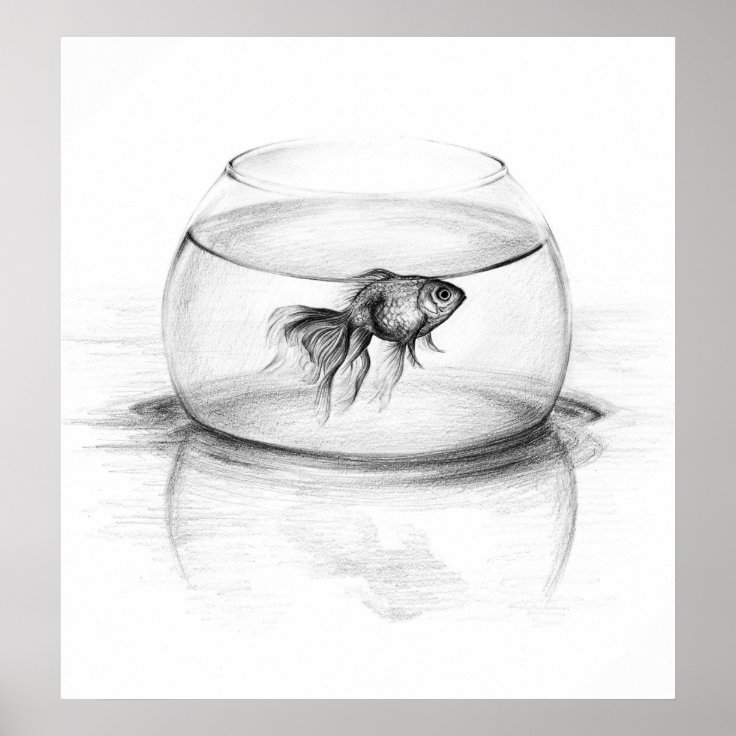
In order to click on bowl in this screenshot , I will do `click(224, 187)`.